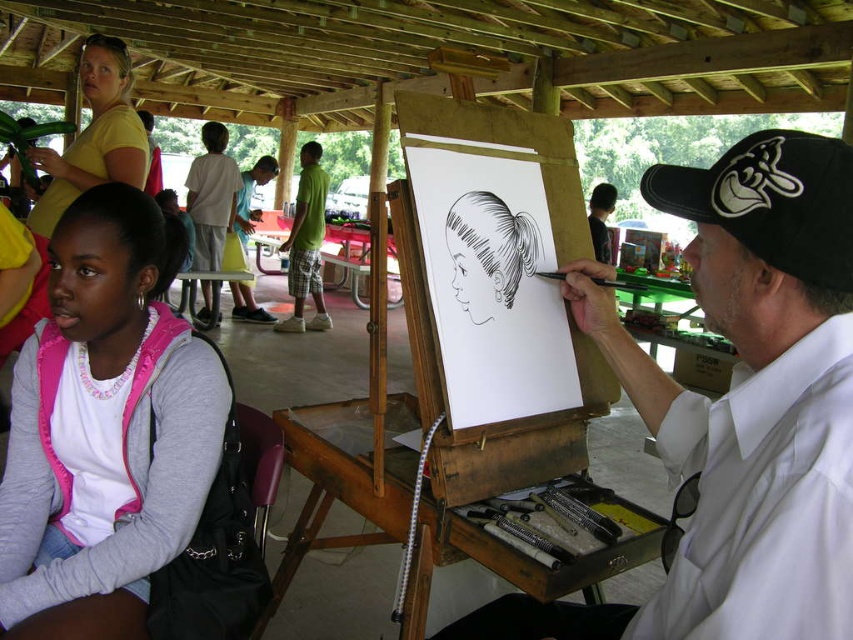
Is point (746, 188) positioned in front of point (592, 237)?

Yes, it is.

Does black fabric baseball cap at upper right have a greater width compared to smooth black cap at upper right?

In fact, black fabric baseball cap at upper right might be narrower than smooth black cap at upper right.

This screenshot has width=853, height=640. Describe the element at coordinates (770, 202) in the screenshot. I see `black fabric baseball cap at upper right` at that location.

Identify the location of black fabric baseball cap at upper right. The width and height of the screenshot is (853, 640). (770, 202).

Between white shirt at center and black fabric baseball cap at upper right, which one has more height?

With more height is white shirt at center.

Describe the element at coordinates (740, 406) in the screenshot. I see `white shirt at center` at that location.

Where is `white shirt at center`? This screenshot has width=853, height=640. white shirt at center is located at coordinates (740, 406).

Does white shirt at center appear over pink fleece jacket at lower left?

Incorrect, white shirt at center is not positioned above pink fleece jacket at lower left.

Does white shirt at center have a lesser width compared to pink fleece jacket at lower left?

In fact, white shirt at center might be wider than pink fleece jacket at lower left.

Locate an element on the screen. white shirt at center is located at coordinates (740, 406).